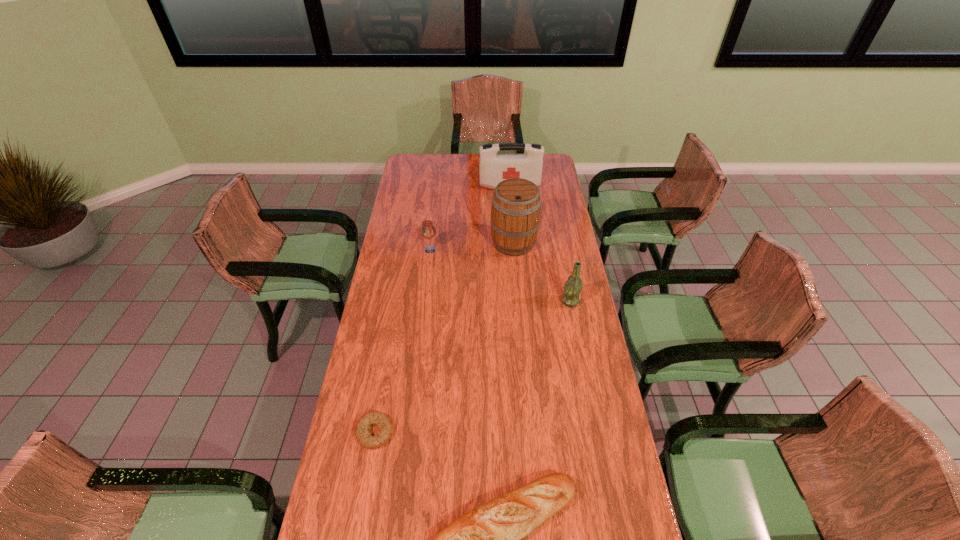
Identify the location of free space at the right edge of the desktop. This screenshot has width=960, height=540. (564, 233).

Locate an element on the screen. This screenshot has width=960, height=540. vacant space at the far right corner is located at coordinates (549, 164).

Identify the location of vacant area between the beer bottle and the first-aid kit. Image resolution: width=960 pixels, height=540 pixels. (540, 244).

Where is `free space between the tallest object and the second nearest object`? free space between the tallest object and the second nearest object is located at coordinates (444, 338).

What are the coordinates of `free space between the first-aid kit and the wineglass` in the screenshot? It's located at (470, 218).

In order to click on free space between the wineglass and the rightmost object in this screenshot , I will do `click(500, 275)`.

You are a GUI agent. You are given a task and a screenshot of the screen. Output one action in this format:
    pyautogui.click(x=<x>, y=<y>)
    Task: Click on the vacant area that lies between the fourth farthest object and the first-aid kit
    
    Given the screenshot: What is the action you would take?
    pyautogui.click(x=540, y=244)

Find the location of a particular element. vacant area that lies between the third shortest object and the shortest object is located at coordinates (402, 341).

This screenshot has height=540, width=960. What are the coordinates of `object that ranks as the fourth closest to the first-aid kit` in the screenshot? It's located at (362, 430).

This screenshot has width=960, height=540. I want to click on object that is the fifth closest to the baguet, so click(493, 168).